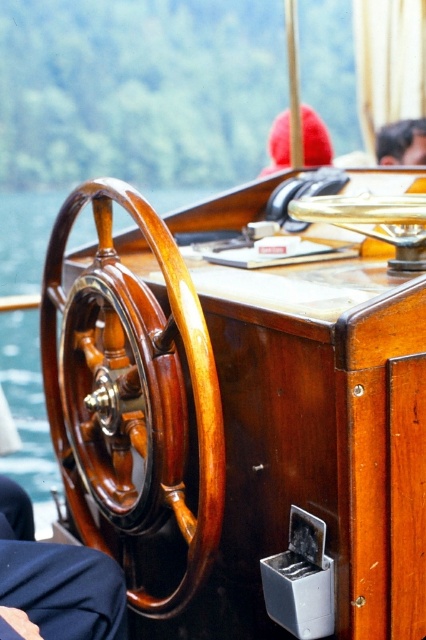
Which is below, dark blue fabric at lower left or brown leather hat at upper center?

dark blue fabric at lower left

Between point (124, 637) and point (385, 156), which one is positioned behind?

Point (385, 156)

Locate an element on the screen. This screenshot has height=640, width=426. dark blue fabric at lower left is located at coordinates (57, 577).

Which of these two, red woolen hat at center or wooden at center, stands shorter?

With less height is wooden at center.

Where is `red woolen hat at center`? This screenshot has width=426, height=640. red woolen hat at center is located at coordinates (314, 138).

Where is `red woolen hat at center`? The width and height of the screenshot is (426, 640). red woolen hat at center is located at coordinates (314, 138).

Can you confirm if shiny brown wood steering wheel at left is smaller than wooden at center?

Actually, shiny brown wood steering wheel at left might be larger than wooden at center.

Describe the element at coordinates (132, 392) in the screenshot. I see `shiny brown wood steering wheel at left` at that location.

The height and width of the screenshot is (640, 426). I want to click on shiny brown wood steering wheel at left, so click(x=132, y=392).